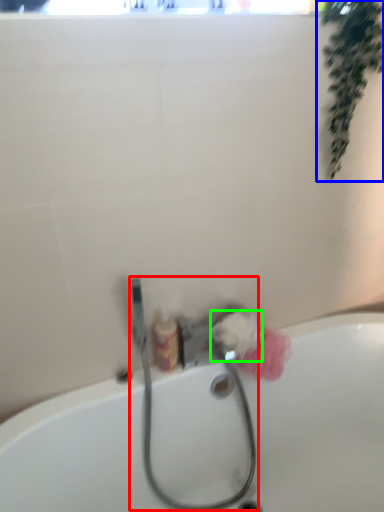
Question: Which object is positioned closest to garden hose (highlighted by a red box)? Select from plant (highlighted by a blue box) and flower (highlighted by a green box).

Choices:
 (A) plant
 (B) flower

Answer: (B)